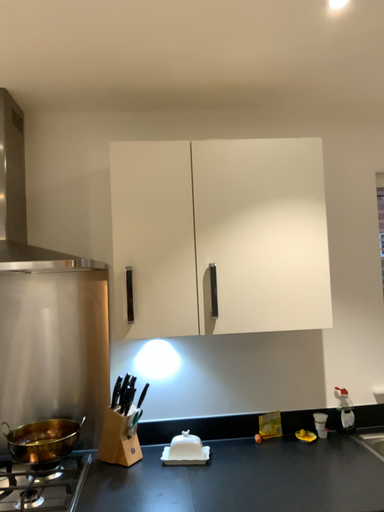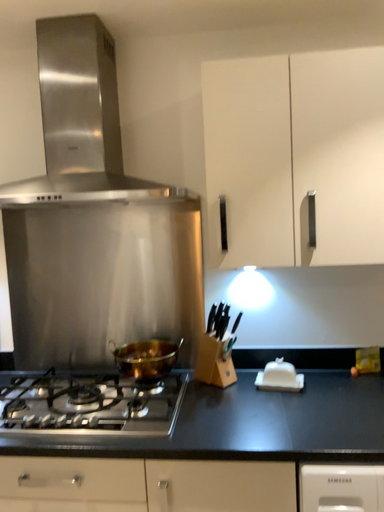
Question: How did the camera likely rotate when shooting the video?

Choices:
 (A) rotated left
 (B) rotated right

Answer: (A)